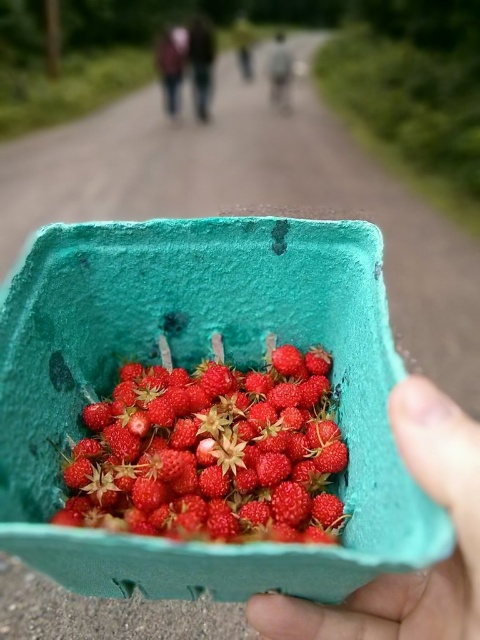
Who is more forward, (269, 428) or (267, 65)?

Point (269, 428) is in front.

Consider the image. Between shiny red berries at center and gray fabric jacket at center, which one appears on the right side from the viewer's perspective?

Positioned to the right is gray fabric jacket at center.

Which is behind, point (336, 436) or point (288, 51)?

The point (288, 51) is more distant.

At what (x,y) coordinates should I click in order to perform the action: click on shiny red berries at center. Please return your answer as a coordinate pair (x, y). The width and height of the screenshot is (480, 640). Looking at the image, I should click on (212, 452).

Who is lower down, green foam tray at lower right or dark brown leather jacket at upper center?

Positioned lower is green foam tray at lower right.

Does green foam tray at lower right lie in front of dark brown leather jacket at upper center?

Yes, green foam tray at lower right is closer to the viewer.

The height and width of the screenshot is (640, 480). What do you see at coordinates (415, 572) in the screenshot? I see `green foam tray at lower right` at bounding box center [415, 572].

The width and height of the screenshot is (480, 640). In order to click on green foam tray at lower right in this screenshot , I will do `click(415, 572)`.

Which of these two, green foam tray at lower right or brown leather jacket at upper center, stands taller?

brown leather jacket at upper center

Is green foam tray at lower right to the left of brown leather jacket at upper center from the viewer's perspective?

Incorrect, green foam tray at lower right is not on the left side of brown leather jacket at upper center.

Is point (257, 611) positioned behind point (166, 60)?

No, (257, 611) is closer to viewer.

Identify the location of green foam tray at lower right. (415, 572).